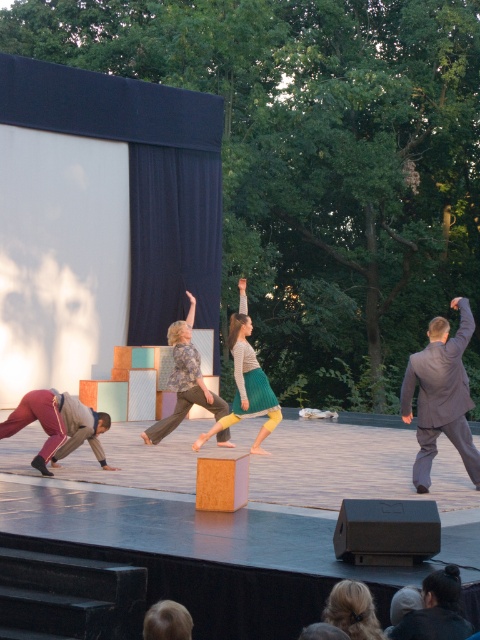
You are an audience member sitting in the front row of the dance performance. You notice two performers on stage. One has maroon fabric pants at left and the other has knitted sweater at center. Which performer is positioned lower in terms of vertical placement?

The maroon fabric pants at left is below knitted sweater at center, so the performer with maroon fabric pants at left is positioned lower vertically than the one with knitted sweater at center.

You are a costume designer observing the dance performance. You need to determine if the maroon fabric pants at left can be paired with the knitted sweater at center for a new outfit. Based on their spatial relationship, can they be worn together?

The maroon fabric pants at left might be wider than knitted sweater at center, so they could potentially be worn together as the pants provide a contrasting silhouette to the sweater.

You are standing in front of the stage and want to determine which of the two points, point (79,403) or point (212,426), is nearer to you. Based on the spatial relationships in the scene, which point is closer?

Point (79,403) is closer to the viewer than point (212,426).